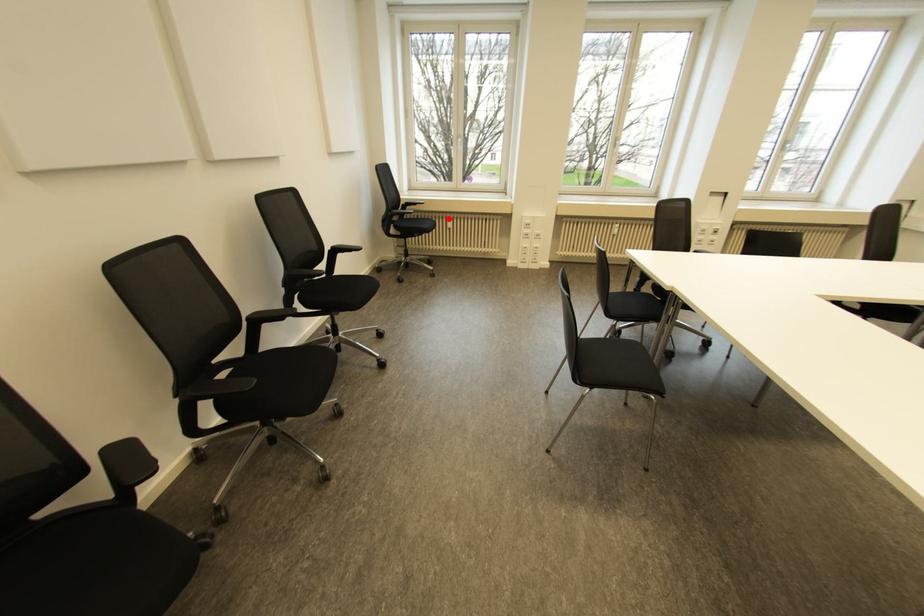
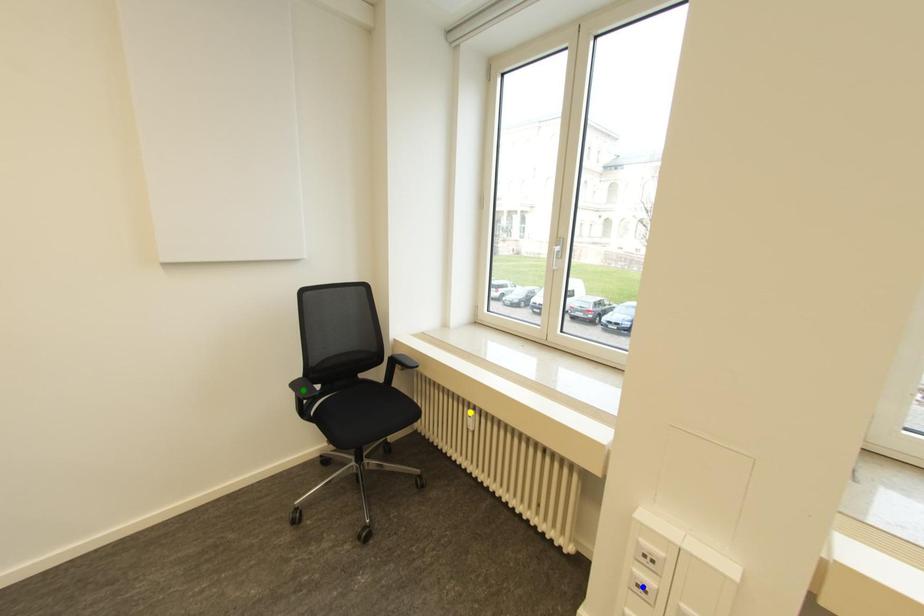
Question: I am providing you with two images of the same scene from different viewpoints. A red point is marked on the first image. You are given multiple points on the second image. In image 2, which mark is for the same physical point as the one in image 1?

Choices:
 (A) blue point
 (B) yellow point
 (C) green point

Answer: (B)